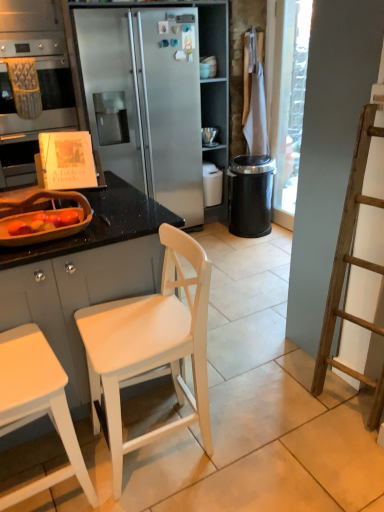
This screenshot has width=384, height=512. What do you see at coordinates (48, 231) in the screenshot?
I see `wooden bowl at left` at bounding box center [48, 231].

What do you see at coordinates (251, 195) in the screenshot? Image resolution: width=384 pixels, height=512 pixels. I see `black plastic trash can at center-right` at bounding box center [251, 195].

You are a GUI agent. You are given a task and a screenshot of the screen. Output one action in this format:
    pyautogui.click(x=<x>, y=<y>)
    Task: Click on the white matte desk at lower left
    The height and width of the screenshot is (512, 384).
    Given the screenshot: What is the action you would take?
    pyautogui.click(x=37, y=403)

The image size is (384, 512). What are the coordinates of `white wood chair at center` in the screenshot? It's located at (150, 347).

Is wooden bowl at left at the back of white matte cabinet at left, which is the 1th cabinetry from bottom to top?

No, white matte cabinet at left, which is the 1th cabinetry from bottom to top, is not facing away from wooden bowl at left.

From a real-world perspective, is white matte cabinet at left, which is the 1th cabinetry from bottom to top, under wooden bowl at left?

Correct, in the physical world, white matte cabinet at left, which is the 1th cabinetry from bottom to top, is lower than wooden bowl at left.

In order to click on cabinetry below the wooden bowl at left (from a real-world perspective) in this screenshot , I will do `click(85, 275)`.

Is white matte cabinet at left, positioned as the second cabinetry in back-to-front order, at the right side of wooden bowl at left?

No, white matte cabinet at left, positioned as the second cabinetry in back-to-front order, is not to the right of wooden bowl at left.

Are brushed metal oven at left, the 1th cabinetry when ordered from back to front, and wooden bowl at left far apart?

Absolutely, brushed metal oven at left, the 1th cabinetry when ordered from back to front, is distant from wooden bowl at left.

From the image's perspective, which one is positioned higher, brushed metal oven at left, the 1th cabinetry when ordered from back to front, or wooden bowl at left?

brushed metal oven at left, the 1th cabinetry when ordered from back to front.

Between brushed metal oven at left, which is the 2th cabinetry in front-to-back order, and wooden bowl at left, which one has more height?

brushed metal oven at left, which is the 2th cabinetry in front-to-back order, is taller.

Considering the relative positions of brushed metal oven at left, which ranks as the 1th cabinetry in top-to-bottom order, and wooden bowl at left in the image provided, is brushed metal oven at left, which ranks as the 1th cabinetry in top-to-bottom order, to the left or to the right of wooden bowl at left?

Clearly, brushed metal oven at left, which ranks as the 1th cabinetry in top-to-bottom order, is on the left of wooden bowl at left in the image.

Is brushed metal oven at left, the 1th cabinetry when ordered from back to front, facing towards white matte cabinet at left, the second cabinetry positioned from the top?

Yes, brushed metal oven at left, the 1th cabinetry when ordered from back to front, is facing white matte cabinet at left, the second cabinetry positioned from the top.

In terms of width, does brushed metal oven at left, the 1th cabinetry when ordered from back to front, look wider or thinner when compared to white matte cabinet at left, arranged as the 1th cabinetry when viewed from the front?

Considering their sizes, brushed metal oven at left, the 1th cabinetry when ordered from back to front, looks slimmer than white matte cabinet at left, arranged as the 1th cabinetry when viewed from the front.

Does brushed metal oven at left, which ranks as the 1th cabinetry in top-to-bottom order, appear on the right side of white matte cabinet at left, which is the 1th cabinetry from bottom to top?

No.

Is brushed metal oven at left, the 1th cabinetry when ordered from back to front, shorter than white matte cabinet at left, which is the 1th cabinetry from bottom to top?

Yes.

Is white matte desk at lower left wider than white matte cabinet at left, which is the 1th cabinetry from bottom to top?

Incorrect, the width of white matte desk at lower left does not surpass that of white matte cabinet at left, which is the 1th cabinetry from bottom to top.

Based on the photo, is white matte desk at lower left looking in the opposite direction of white matte cabinet at left, which is the 1th cabinetry from bottom to top?

white matte desk at lower left does not have its back to white matte cabinet at left, which is the 1th cabinetry from bottom to top.

In terms of size, does white matte desk at lower left appear bigger or smaller than white matte cabinet at left, which is the 1th cabinetry from bottom to top?

In the image, white matte desk at lower left appears to be smaller than white matte cabinet at left, which is the 1th cabinetry from bottom to top.

Based on the photo, is brushed metal oven at left, which ranks as the 1th cabinetry in top-to-bottom order, positioned beyond the bounds of white wood chair at center?

Indeed, brushed metal oven at left, which ranks as the 1th cabinetry in top-to-bottom order, is completely outside white wood chair at center.

Considering the sizes of brushed metal oven at left, which is the 2th cabinetry in front-to-back order, and white wood chair at center in the image, is brushed metal oven at left, which is the 2th cabinetry in front-to-back order, wider or thinner than white wood chair at center?

Considering their sizes, brushed metal oven at left, which is the 2th cabinetry in front-to-back order, looks broader than white wood chair at center.

Considering the points (65, 66) and (121, 344), which point is in front, point (65, 66) or point (121, 344)?

The point (121, 344) is in front.

Is brushed metal oven at left, acting as the 2th cabinetry starting from the bottom, at the right side of white wood chair at center?

In fact, brushed metal oven at left, acting as the 2th cabinetry starting from the bottom, is to the left of white wood chair at center.

Are wooden bowl at left and white matte desk at lower left far apart?

No.

Would you say white matte desk at lower left is part of wooden bowl at left's contents?

Definitely not — white matte desk at lower left is not inside wooden bowl at left.

Is wooden bowl at left shorter than white matte desk at lower left?

Yes, wooden bowl at left is shorter than white matte desk at lower left.

From the image's perspective, is wooden bowl at left above white matte desk at lower left?

Yes, from the image's perspective, wooden bowl at left is on top of white matte desk at lower left.

From a real-world perspective, is white matte cabinet at left, which is the 1th cabinetry from bottom to top, positioned above or below white wood chair at center?

Clearly, from a real-world perspective, white matte cabinet at left, which is the 1th cabinetry from bottom to top, is below white wood chair at center.

Does white matte cabinet at left, positioned as the second cabinetry in back-to-front order, come in front of white wood chair at center?

No, the depth of white matte cabinet at left, positioned as the second cabinetry in back-to-front order, is greater than that of white wood chair at center.

Is white matte cabinet at left, positioned as the second cabinetry in back-to-front order, oriented away from white wood chair at center?

No, white matte cabinet at left, positioned as the second cabinetry in back-to-front order, is not facing away from white wood chair at center.

The image size is (384, 512). I want to click on cabinetry that appears below the wooden bowl at left (from the image's perspective), so (85, 275).

Identify the location of cabinetry above the wooden bowl at left (from a real-world perspective). (39, 82).

Considering their positions, is white matte cabinet at left, arranged as the 1th cabinetry when viewed from the front, positioned further to white matte desk at lower left than wooden bowl at left?

The object further to white matte desk at lower left is wooden bowl at left.

From the image, which object appears to be farther from white wood chair at center, black plastic trash can at center-right or white matte desk at lower left?

black plastic trash can at center-right is further to white wood chair at center.

Based on their spatial positions, is white wood chair at center or white matte desk at lower left further from black plastic trash can at center-right?

white matte desk at lower left is positioned further to the anchor black plastic trash can at center-right.

Considering their positions, is brushed metal oven at left, the 1th cabinetry when ordered from back to front, positioned further to wooden bowl at left than white matte desk at lower left?

Based on the image, brushed metal oven at left, the 1th cabinetry when ordered from back to front, appears to be further to wooden bowl at left.

Considering their positions, is brushed metal oven at left, the 1th cabinetry when ordered from back to front, positioned closer to black plastic trash can at center-right than white wood chair at center?

Among the two, brushed metal oven at left, the 1th cabinetry when ordered from back to front, is located nearer to black plastic trash can at center-right.

Which object lies nearer to the anchor point wooden bowl at left, black plastic trash can at center-right or brushed metal oven at left, which is the 2th cabinetry in front-to-back order?

The object closer to wooden bowl at left is brushed metal oven at left, which is the 2th cabinetry in front-to-back order.

Looking at the image, which one is located further to white matte desk at lower left, white wood chair at center or brushed metal oven at left, acting as the 2th cabinetry starting from the bottom?

Among the two, brushed metal oven at left, acting as the 2th cabinetry starting from the bottom, is located further to white matte desk at lower left.

Looking at the image, which one is located closer to white wood chair at center, white matte cabinet at left, which is the 1th cabinetry from bottom to top, or white matte desk at lower left?

white matte cabinet at left, which is the 1th cabinetry from bottom to top.

Where is `appliance between white matte desk at lower left and black plastic trash can at center-right along the z-axis`? appliance between white matte desk at lower left and black plastic trash can at center-right along the z-axis is located at coordinates (48, 231).

Locate an element on the screen. chair that lies between brushed metal oven at left, which is the 2th cabinetry in front-to-back order, and white matte desk at lower left from top to bottom is located at coordinates (150, 347).

This screenshot has height=512, width=384. Find the location of `appliance located between white matte desk at lower left and brushed metal oven at left, the 1th cabinetry when ordered from back to front, in the depth direction`. appliance located between white matte desk at lower left and brushed metal oven at left, the 1th cabinetry when ordered from back to front, in the depth direction is located at coordinates (48, 231).

Image resolution: width=384 pixels, height=512 pixels. I want to click on cabinetry between brushed metal oven at left, the 1th cabinetry when ordered from back to front, and white wood chair at center from top to bottom, so click(85, 275).